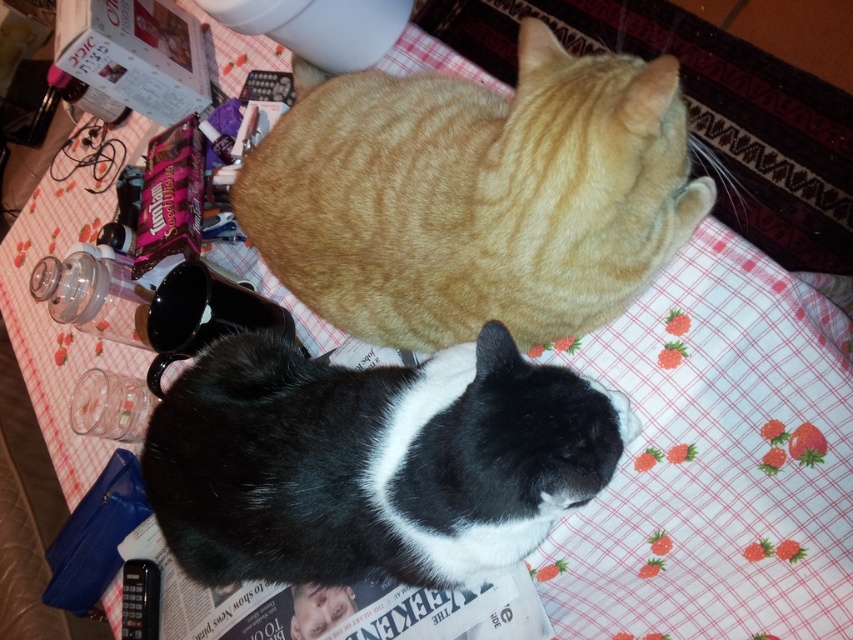
Question: Is orange tabby cat at upper center to the left of black and white fur cat at center from the viewer's perspective?

Choices:
 (A) no
 (B) yes

Answer: (A)

Question: Does orange tabby cat at upper center have a greater width compared to black and white fur cat at center?

Choices:
 (A) no
 (B) yes

Answer: (B)

Question: Is orange tabby cat at upper center wider than black and white fur cat at center?

Choices:
 (A) yes
 (B) no

Answer: (A)

Question: Which object is closer to the camera taking this photo?

Choices:
 (A) black and white fur cat at center
 (B) orange tabby cat at upper center

Answer: (A)